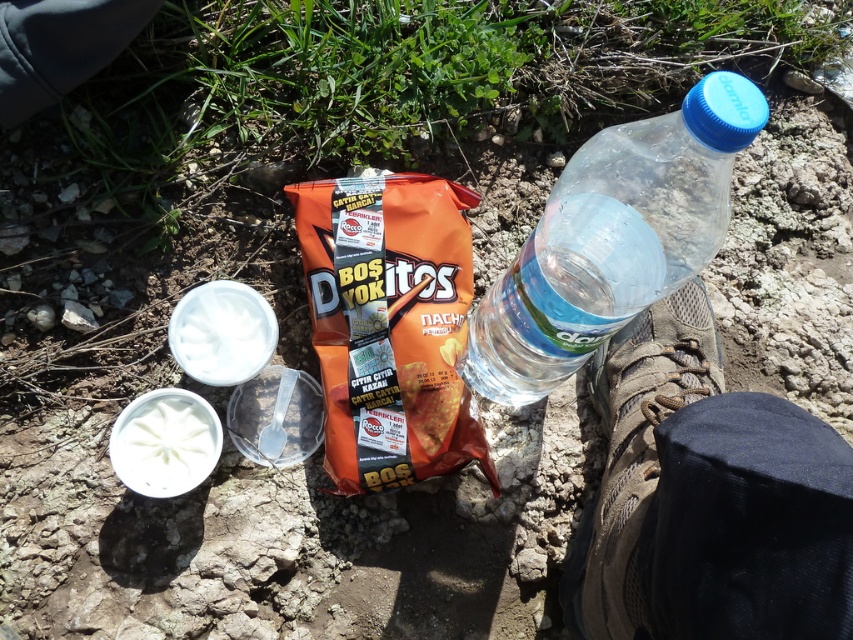
Is point (386, 476) positioned after point (519, 252)?

No.

Can you confirm if orange matte doritos at center is positioned to the left of transparent plastic bottle at right?

Correct, you'll find orange matte doritos at center to the left of transparent plastic bottle at right.

Which is behind, point (395, 388) or point (589, 141)?

Point (395, 388)

Where is `orange matte doritos at center`? Image resolution: width=853 pixels, height=640 pixels. orange matte doritos at center is located at coordinates (390, 326).